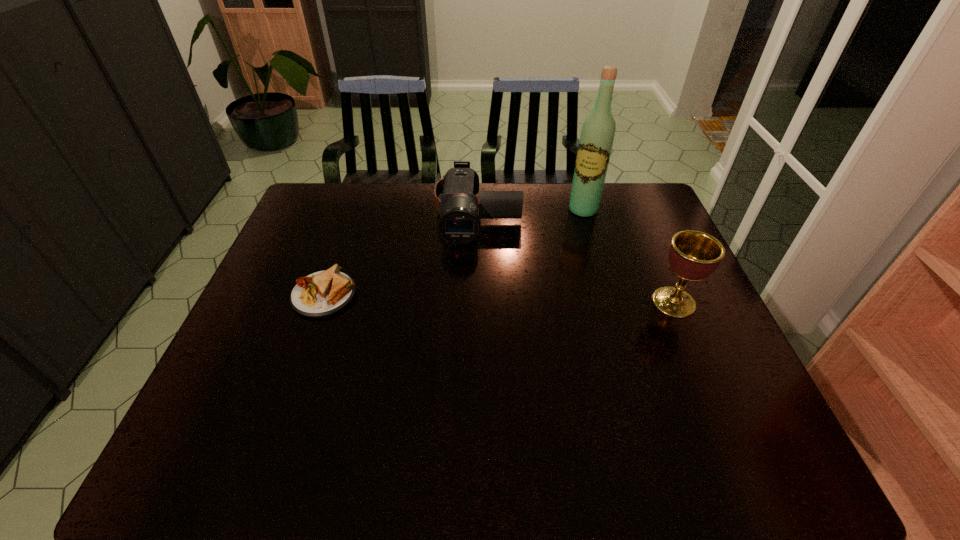
The width and height of the screenshot is (960, 540). What are the coordinates of `free region located on the lens of the second object from left to right` in the screenshot? It's located at 472,346.

Identify the location of vacant space situated 0.150m on the lens of the second object from left to right. The height and width of the screenshot is (540, 960). tap(475, 280).

You are a GUI agent. You are given a task and a screenshot of the screen. Output one action in this format:
    pyautogui.click(x=<x>, y=<y>)
    Task: Click on the vacant space located on the lens of the second object from left to right
    This screenshot has height=540, width=960.
    Given the screenshot: What is the action you would take?
    pyautogui.click(x=472, y=343)

This screenshot has height=540, width=960. What are the coordinates of `vacant region located 0.170m on the front-facing side of the third object from left to right` in the screenshot? It's located at (561, 247).

Locate an element on the screen. Image resolution: width=960 pixels, height=540 pixels. free space located 0.350m on the front-facing side of the third object from left to right is located at coordinates (538, 284).

Where is `vacant space located 0.380m on the front-facing side of the third object from left to right`? vacant space located 0.380m on the front-facing side of the third object from left to right is located at coordinates (534, 291).

This screenshot has height=540, width=960. I want to click on camcorder that is positioned at the far edge, so click(459, 223).

You are a GUI agent. You are given a task and a screenshot of the screen. Output one action in this format:
    pyautogui.click(x=<x>, y=<y>)
    Task: Click on the wine bottle at the far edge
    This screenshot has width=960, height=540.
    Given the screenshot: What is the action you would take?
    pyautogui.click(x=597, y=135)

Find the location of a particular element. The image size is (960, 540). object that is at the left edge is located at coordinates (323, 293).

This screenshot has width=960, height=540. I want to click on object that is at the right edge, so click(693, 255).